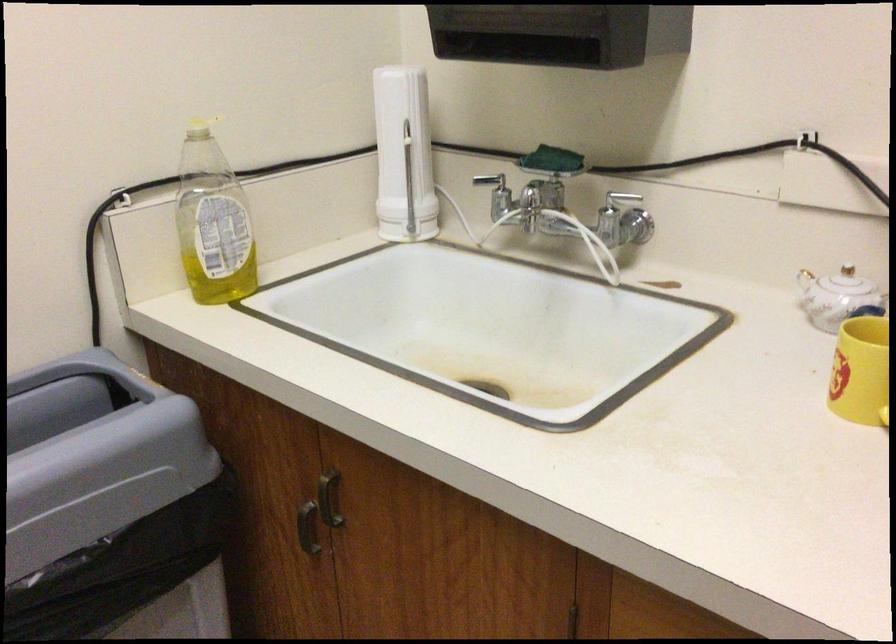
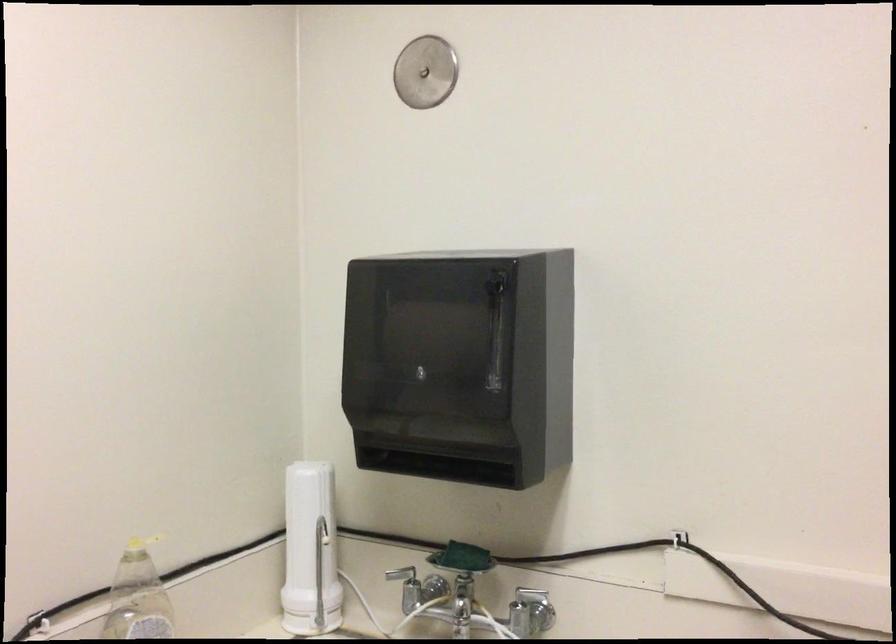
The point at (x=583, y=238) is marked in the first image. Where is the corresponding point in the second image?

(490, 621)